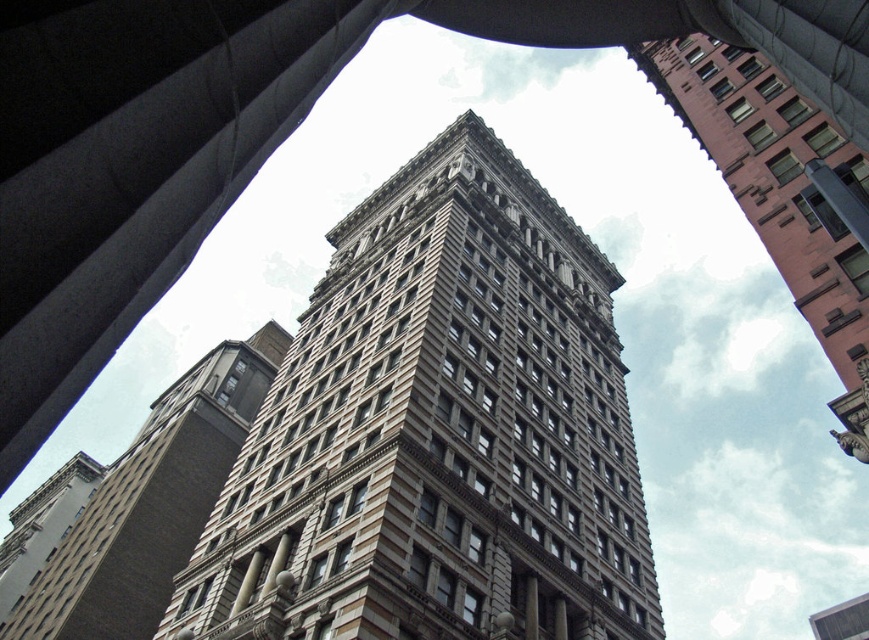
Who is more distant from viewer, (277, 349) or (764, 232)?

Positioned behind is point (277, 349).

Who is lower down, brown stone building at center or pink brick building at upper right?

brown stone building at center

Between point (144, 570) and point (864, 182), which one is positioned in front?

Point (864, 182) is more forward.

Where is `brown stone building at center`? brown stone building at center is located at coordinates (136, 506).

Is brown stone tower at center thinner than pink brick building at upper right?

No, brown stone tower at center is not thinner than pink brick building at upper right.

Does point (547, 284) lie in front of point (774, 74)?

That is False.

Which is behind, point (501, 572) or point (798, 225)?

Positioned behind is point (798, 225).

This screenshot has width=869, height=640. I want to click on brown stone tower at center, so click(x=438, y=433).

Who is higher up, brown stone tower at center or brown stone building at center?

brown stone tower at center

How far apart are brown stone tower at center and brown stone building at center?

The distance of brown stone tower at center from brown stone building at center is 35.28 meters.

Which is behind, point (541, 225) or point (87, 548)?

The point (541, 225) is more distant.

Where is `brown stone tower at center`? Image resolution: width=869 pixels, height=640 pixels. brown stone tower at center is located at coordinates (438, 433).